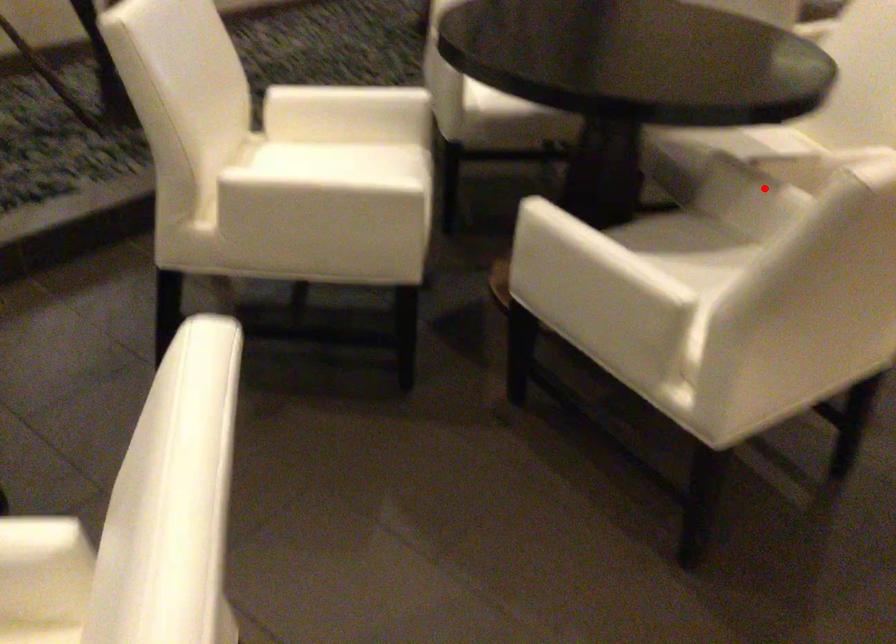
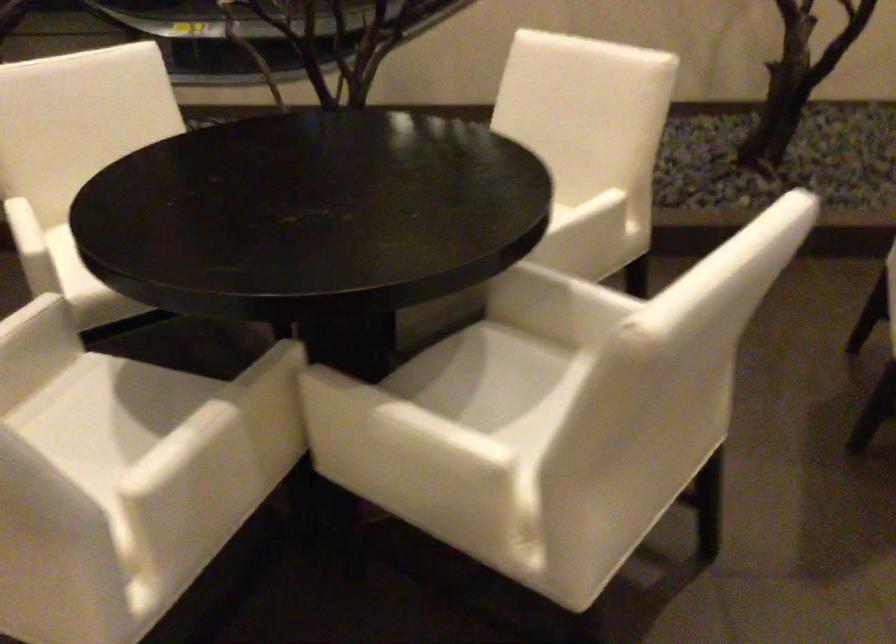
Question: I am providing you with two images of the same scene from different viewpoints. In image1, a red point is highlighted. Considering the same 3D point in image2, which of the following is correct?

Choices:
 (A) It is closer
 (B) It is farther

Answer: (A)